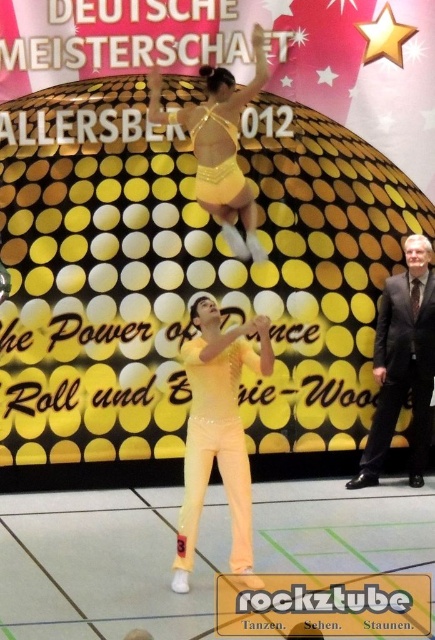
Question: From the image, what is the correct spatial relationship of dark gray suit at right in relation to yellow shiny dress at center?

Choices:
 (A) left
 (B) right

Answer: (B)

Question: Which of the following is the closest to the observer?

Choices:
 (A) (198, 132)
 (B) (391, 339)
 (C) (271, 368)

Answer: (C)

Question: Is matte yellow pants at center in front of dark gray suit at right?

Choices:
 (A) no
 (B) yes

Answer: (B)

Question: Considering the relative positions of matte yellow pants at center and dark gray suit at right in the image provided, where is matte yellow pants at center located with respect to dark gray suit at right?

Choices:
 (A) above
 (B) below

Answer: (B)

Question: Which object is closer to the camera taking this photo?

Choices:
 (A) yellow satin dress at center
 (B) dark gray suit at right
 (C) matte yellow pants at center
 (D) yellow shiny dress at center

Answer: (C)

Question: Which object is positioned closest to the matte yellow pants at center?

Choices:
 (A) yellow shiny dress at center
 (B) yellow satin dress at center

Answer: (A)